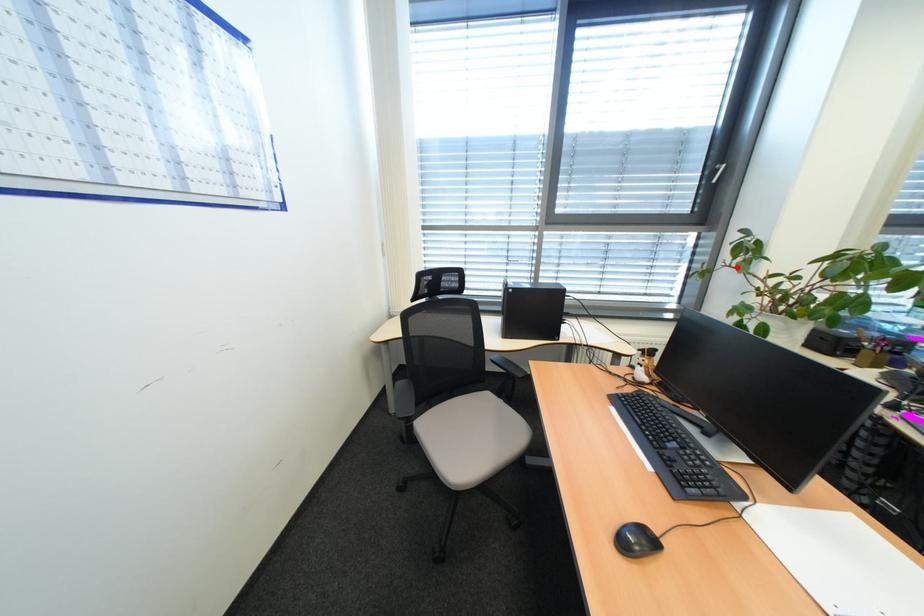
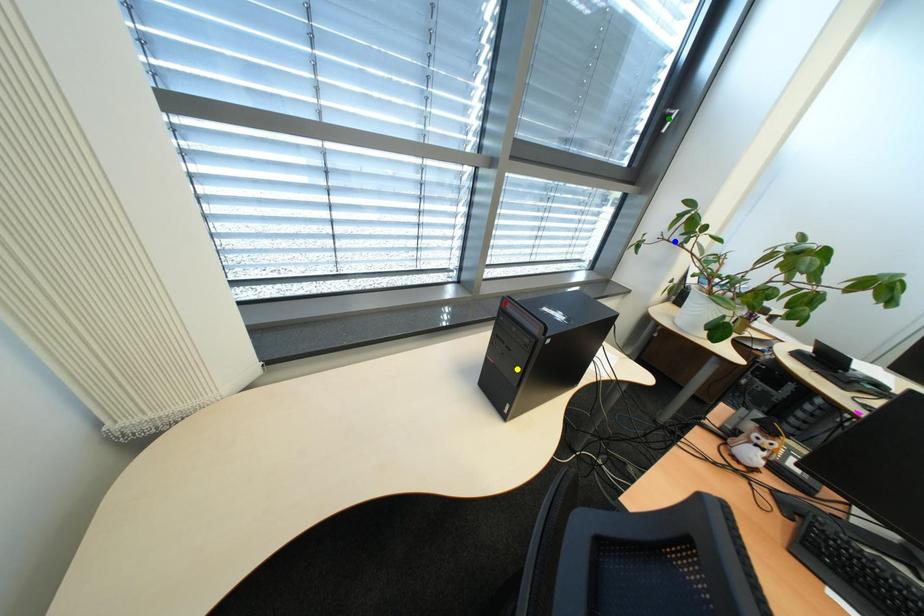
Question: I am providing you with two images of the same scene from different viewpoints. A red point is marked on the first image. You are given multiple points on the second image. Which mark in image 2 goes with the point in image 1?

Choices:
 (A) blue point
 (B) yellow point
 (C) green point

Answer: (A)